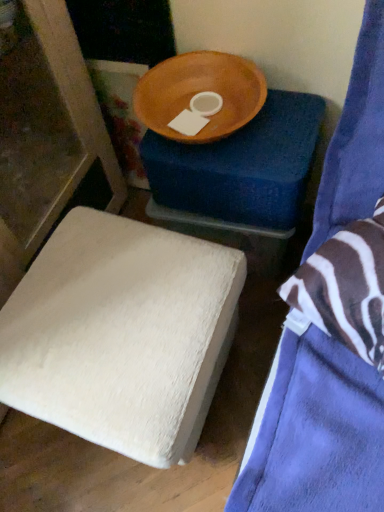
Question: Is blue fabric bed at upper right, placed as the 3th furniture when sorted from back to front, thinner than wooden bowl at upper center?

Choices:
 (A) yes
 (B) no

Answer: (B)

Question: Is blue fabric bed at upper right, acting as the 1th furniture starting from the front, not close to wooden bowl at upper center?

Choices:
 (A) yes
 (B) no

Answer: (B)

Question: Is the depth of blue fabric bed at upper right, acting as the 1th furniture starting from the front, less than that of wooden bowl at upper center?

Choices:
 (A) no
 (B) yes

Answer: (B)

Question: From the image's perspective, would you say blue fabric bed at upper right, placed as the 3th furniture when sorted from back to front, is positioned over wooden bowl at upper center?

Choices:
 (A) yes
 (B) no

Answer: (B)

Question: Is wooden bowl at upper center at the back of blue fabric bed at upper right, acting as the 1th furniture starting from the front?

Choices:
 (A) yes
 (B) no

Answer: (B)

Question: Considering the relative sizes of blue fabric bed at upper right, placed as the 3th furniture when sorted from back to front, and wooden bowl at upper center in the image provided, is blue fabric bed at upper right, placed as the 3th furniture when sorted from back to front, bigger than wooden bowl at upper center?

Choices:
 (A) yes
 (B) no

Answer: (A)

Question: Is the position of white fuzzy ottoman at lower left, which is the second furniture from back to front, less distant than that of wooden bowl at upper center?

Choices:
 (A) no
 (B) yes

Answer: (B)

Question: From the image's perspective, is white fuzzy ottoman at lower left, which is the second furniture from back to front, located above wooden bowl at upper center?

Choices:
 (A) yes
 (B) no

Answer: (B)

Question: Can you confirm if white fuzzy ottoman at lower left, which is the second furniture from back to front, is bigger than wooden bowl at upper center?

Choices:
 (A) no
 (B) yes

Answer: (B)

Question: Does white fuzzy ottoman at lower left, which is the second furniture from back to front, have a greater width compared to wooden bowl at upper center?

Choices:
 (A) no
 (B) yes

Answer: (B)

Question: From the image's perspective, does white fuzzy ottoman at lower left, which is the second furniture from back to front, appear lower than wooden bowl at upper center?

Choices:
 (A) yes
 (B) no

Answer: (A)

Question: Can you confirm if white fuzzy ottoman at lower left, which is the second furniture from back to front, is shorter than wooden bowl at upper center?

Choices:
 (A) yes
 (B) no

Answer: (B)

Question: Does wooden bowl at upper center have a larger size compared to blue fabric bed at upper right, acting as the 1th furniture starting from the front?

Choices:
 (A) yes
 (B) no

Answer: (B)